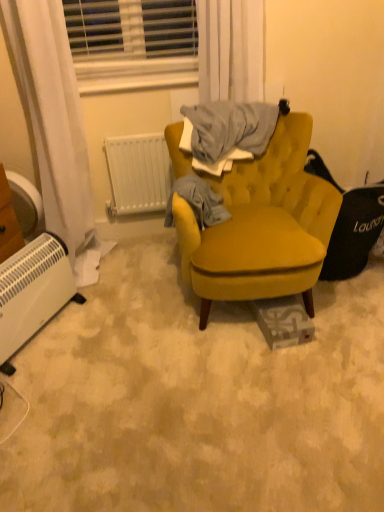
Question: From a real-world perspective, is gray cotton sweater at center positioned above or below white plastic blinds at upper center?

Choices:
 (A) below
 (B) above

Answer: (A)

Question: Relative to white plastic blinds at upper center, is gray cotton sweater at center in front or behind?

Choices:
 (A) behind
 (B) front

Answer: (B)

Question: Estimate the real-world distances between objects in this image. Which object is closer to the gray cotton sweater at center?

Choices:
 (A) white plastic radiator at lower left, arranged as the second radiator when viewed from the top
 (B) white plastic blinds at upper center
 (C) velvet mustard swivel chair at right
 (D) mustard fabric chair at center
 (E) white sheer curtain at upper center

Answer: (D)

Question: Estimate the real-world distances between objects in this image. Which object is farther from the velvet mustard swivel chair at right?

Choices:
 (A) white plastic blinds at upper center
 (B) white plastic radiator at lower left, marked as the first radiator in a bottom-to-top arrangement
 (C) white plastic radiator at center, positioned as the 2th radiator in bottom-to-top order
 (D) white sheer curtain at upper center
 (E) mustard fabric chair at center

Answer: (B)